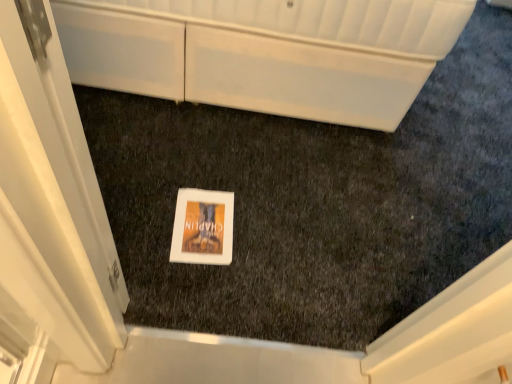
You are a GUI agent. You are given a task and a screenshot of the screen. Output one action in this format:
    pyautogui.click(x=<x>, y=<y>)
    Task: Click on the white glossy cabinet at upper center
    This screenshot has width=512, height=384.
    Given the screenshot: What is the action you would take?
    pos(265,52)

What do you see at coordinates (265, 52) in the screenshot?
I see `white glossy cabinet at upper center` at bounding box center [265, 52].

The image size is (512, 384). What do you see at coordinates (52, 203) in the screenshot?
I see `white glossy door at center` at bounding box center [52, 203].

You are a GUI agent. You are given a task and a screenshot of the screen. Output one action in this format:
    pyautogui.click(x=<x>, y=<y>)
    Task: Click on the white glossy door at center
    The width and height of the screenshot is (512, 384).
    Given the screenshot: What is the action you would take?
    pyautogui.click(x=52, y=203)

Find the location of a particular element. The width and height of the screenshot is (512, 384). white glossy cabinet at upper center is located at coordinates (265, 52).

In the scene shown: Visually, is white glossy cabinet at upper center positioned to the left or to the right of white glossy door at center?

white glossy cabinet at upper center is positioned on white glossy door at center's right side.

Is the depth of white glossy cabinet at upper center less than that of white glossy door at center?

That is False.

Is point (121, 79) behind point (29, 130)?

Yes, it is.

From the image's perspective, is white glossy cabinet at upper center positioned above or below white glossy door at center?

From the image's perspective, white glossy cabinet at upper center appears above white glossy door at center.

From a real-world perspective, who is located higher, white glossy cabinet at upper center or white glossy door at center?

In real-world perspective, white glossy door at center is above.

Does white glossy cabinet at upper center have a lesser width compared to white glossy door at center?

Incorrect, the width of white glossy cabinet at upper center is not less than that of white glossy door at center.

Considering the sizes of objects white glossy cabinet at upper center and white glossy door at center in the image provided, who is taller, white glossy cabinet at upper center or white glossy door at center?

white glossy door at center is taller.

Between white glossy cabinet at upper center and white glossy door at center, which one has larger size?

white glossy cabinet at upper center.

Is white glossy door at center located within white glossy cabinet at upper center?

Actually, white glossy door at center is outside white glossy cabinet at upper center.

Would you say white glossy cabinet at upper center is a long distance from white glossy door at center?

white glossy cabinet at upper center is positioned a significant distance from white glossy door at center.

Is white glossy cabinet at upper center facing towards white glossy door at center?

No, white glossy cabinet at upper center is not aimed at white glossy door at center.

How different are the orientations of white glossy cabinet at upper center and white glossy door at center in degrees?

86.5 degrees separate the facing orientations of white glossy cabinet at upper center and white glossy door at center.

Locate an element on the screen. The image size is (512, 384). screen door on the left of white glossy cabinet at upper center is located at coordinates (52, 203).

Which is more to the right, white glossy door at center or white glossy cabinet at upper center?

From the viewer's perspective, white glossy cabinet at upper center appears more on the right side.

Does white glossy door at center lie in front of white glossy cabinet at upper center?

Yes, it is in front of white glossy cabinet at upper center.

Between point (75, 251) and point (169, 86), which one is positioned behind?

The point (169, 86) is more distant.

From the image's perspective, is white glossy door at center located beneath white glossy cabinet at upper center?

Yes, from the image's perspective, white glossy door at center is below white glossy cabinet at upper center.

From a real-world perspective, between white glossy door at center and white glossy cabinet at upper center, who is vertically lower?

white glossy cabinet at upper center is physically lower.

Can you confirm if white glossy door at center is wider than white glossy cabinet at upper center?

In fact, white glossy door at center might be narrower than white glossy cabinet at upper center.

Considering the relative sizes of white glossy door at center and white glossy cabinet at upper center in the image provided, is white glossy door at center taller than white glossy cabinet at upper center?

Correct, white glossy door at center is much taller as white glossy cabinet at upper center.

Which of these two, white glossy door at center or white glossy cabinet at upper center, is bigger?

With larger size is white glossy cabinet at upper center.

Does white glossy door at center contain white glossy cabinet at upper center?

Actually, white glossy cabinet at upper center is outside white glossy door at center.

Is white glossy door at center beside white glossy cabinet at upper center?

white glossy door at center is not next to white glossy cabinet at upper center, and they're not touching.

Is white glossy door at center looking in the opposite direction of white glossy cabinet at upper center?

No, white glossy cabinet at upper center is not at the back of white glossy door at center.

What's the angular difference between white glossy door at center and white glossy cabinet at upper center's facing directions?

white glossy door at center and white glossy cabinet at upper center are facing 86.5 degrees away from each other.

Where is `screen door below the white glossy cabinet at upper center (from the image's perspective)`? This screenshot has height=384, width=512. screen door below the white glossy cabinet at upper center (from the image's perspective) is located at coordinates (52, 203).

In order to click on cabinetry that appears on the right of white glossy door at center in this screenshot , I will do `click(265, 52)`.

At what (x,y) coordinates should I click in order to perform the action: click on screen door on the left of white glossy cabinet at upper center. Please return your answer as a coordinate pair (x, y). The image size is (512, 384). Looking at the image, I should click on (52, 203).